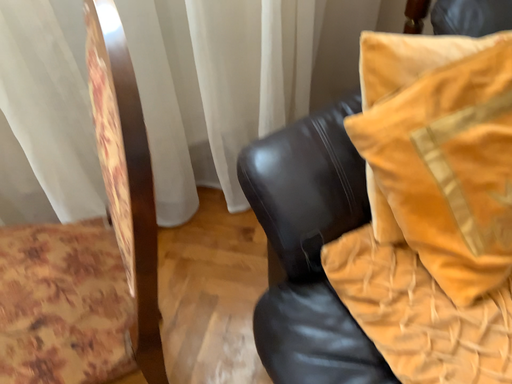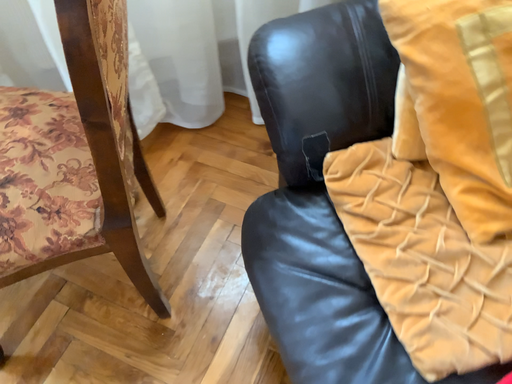
Question: How did the camera likely rotate when shooting the video?

Choices:
 (A) rotated left
 (B) rotated right

Answer: (A)